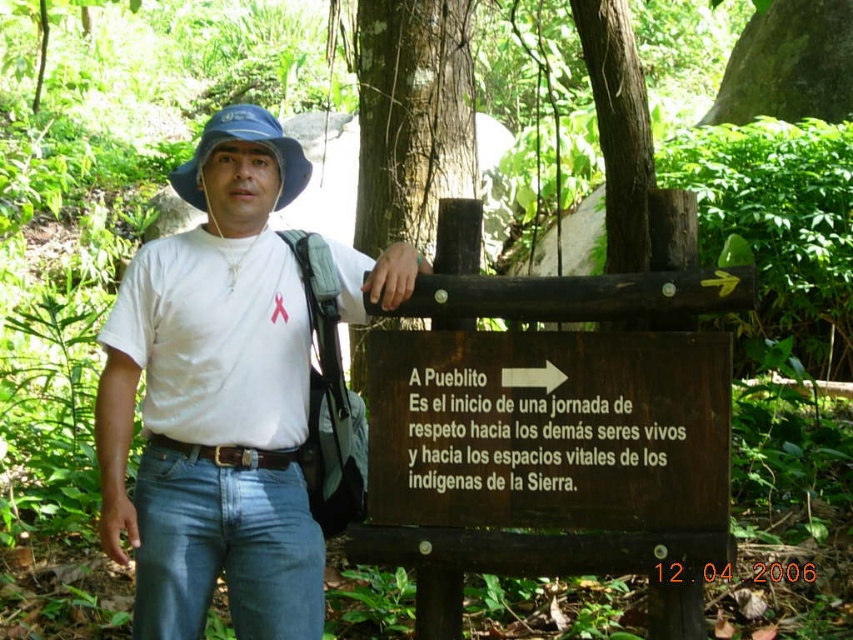
Is white cotton shirt at center shorter than smooth brown tree trunk at center?

In fact, white cotton shirt at center may be taller than smooth brown tree trunk at center.

Describe the element at coordinates (215, 401) in the screenshot. The image size is (853, 640). I see `white cotton shirt at center` at that location.

Identify the location of white cotton shirt at center. The height and width of the screenshot is (640, 853). (215, 401).

This screenshot has width=853, height=640. What do you see at coordinates (618, 129) in the screenshot? I see `smooth brown tree trunk at upper center` at bounding box center [618, 129].

Between smooth brown tree trunk at upper center and blue fabric hat at upper center, which one has less height?

Standing shorter between the two is blue fabric hat at upper center.

You are a GUI agent. You are given a task and a screenshot of the screen. Output one action in this format:
    pyautogui.click(x=<x>, y=<y>)
    Task: Click on the smooth brown tree trunk at upper center
    The image size is (853, 640).
    Given the screenshot: What is the action you would take?
    pyautogui.click(x=618, y=129)

Identify the location of smooth brown tree trunk at upper center. (618, 129).

In order to click on brown wooden sign at center in this screenshot , I will do click(x=548, y=429).

Who is more forward, (497,461) or (216,124)?

Positioned in front is point (497,461).

Is point (643, 502) positioned before point (225, 113)?

Yes.

Locate an element on the screen. The image size is (853, 640). brown wooden sign at center is located at coordinates (548, 429).